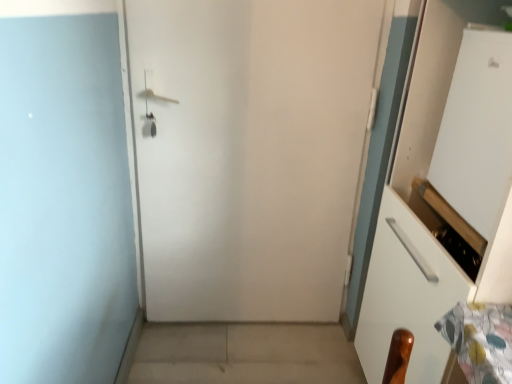
Question: From the image's perspective, is white matte door at center beneath white glossy screen door at upper right?

Choices:
 (A) yes
 (B) no

Answer: (A)

Question: Is there a large distance between white matte door at center and white glossy screen door at upper right?

Choices:
 (A) no
 (B) yes

Answer: (A)

Question: Can you confirm if white matte door at center is wider than white glossy screen door at upper right?

Choices:
 (A) no
 (B) yes

Answer: (A)

Question: Considering the relative sizes of white matte door at center and white glossy screen door at upper right in the image provided, is white matte door at center bigger than white glossy screen door at upper right?

Choices:
 (A) yes
 (B) no

Answer: (A)

Question: From a real-world perspective, is white matte door at center over white glossy screen door at upper right?

Choices:
 (A) no
 (B) yes

Answer: (A)

Question: Is the depth of white matte door at center greater than that of white glossy screen door at upper right?

Choices:
 (A) no
 (B) yes

Answer: (B)

Question: From a real-world perspective, is beige concrete at lower center over white glossy screen door at upper right?

Choices:
 (A) yes
 (B) no

Answer: (B)

Question: Is beige concrete at lower center thinner than white glossy screen door at upper right?

Choices:
 (A) yes
 (B) no

Answer: (B)

Question: Is white glossy screen door at upper right located within beige concrete at lower center?

Choices:
 (A) yes
 (B) no

Answer: (B)

Question: Is beige concrete at lower center outside white glossy screen door at upper right?

Choices:
 (A) no
 (B) yes

Answer: (B)

Question: Considering the relative sizes of beige concrete at lower center and white glossy screen door at upper right in the image provided, is beige concrete at lower center shorter than white glossy screen door at upper right?

Choices:
 (A) yes
 (B) no

Answer: (A)

Question: From the image's perspective, is beige concrete at lower center beneath white glossy screen door at upper right?

Choices:
 (A) no
 (B) yes

Answer: (B)

Question: Is white matte door at center at the back of white glossy screen door at upper right?

Choices:
 (A) no
 (B) yes

Answer: (A)